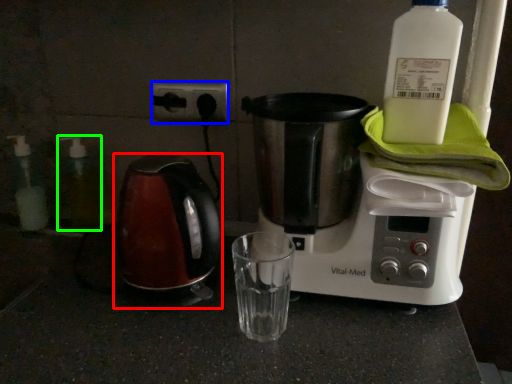
Question: Which object is the farthest from kettle (highlighted by a red box)? Choose among these: electric outlet (highlighted by a blue box) or bottle (highlighted by a green box).

Choices:
 (A) electric outlet
 (B) bottle

Answer: (B)